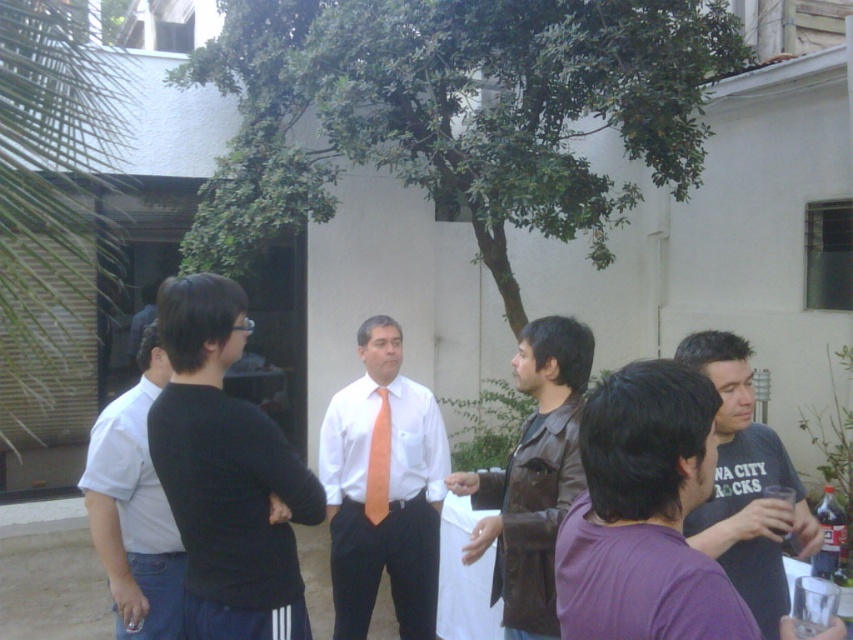
Can you confirm if matte orange tie at center is positioned below brown leather jacket at center?

Indeed, matte orange tie at center is positioned under brown leather jacket at center.

Consider the image. Who is more forward, (426,481) or (561,474)?

Point (561,474) is in front.

Is point (376, 419) positioned before point (579, 488)?

No, (376, 419) is further to viewer.

At what (x,y) coordinates should I click in order to perform the action: click on matte orange tie at center. Please return your answer as a coordinate pair (x, y). The height and width of the screenshot is (640, 853). Looking at the image, I should click on (383, 488).

Is black cotton shirt at left positioned in front of orange satin tie at center?

Yes, black cotton shirt at left is in front of orange satin tie at center.

At what (x,y) coordinates should I click in order to perform the action: click on black cotton shirt at left. Please return your answer as a coordinate pair (x, y). Looking at the image, I should click on (134, 508).

Identify the location of brown leather jacket at center. (532, 477).

Measure the distance between brown leather jacket at center and camera.

A distance of 8.60 feet exists between brown leather jacket at center and camera.

Where is `brown leather jacket at center`? brown leather jacket at center is located at coordinates (532, 477).